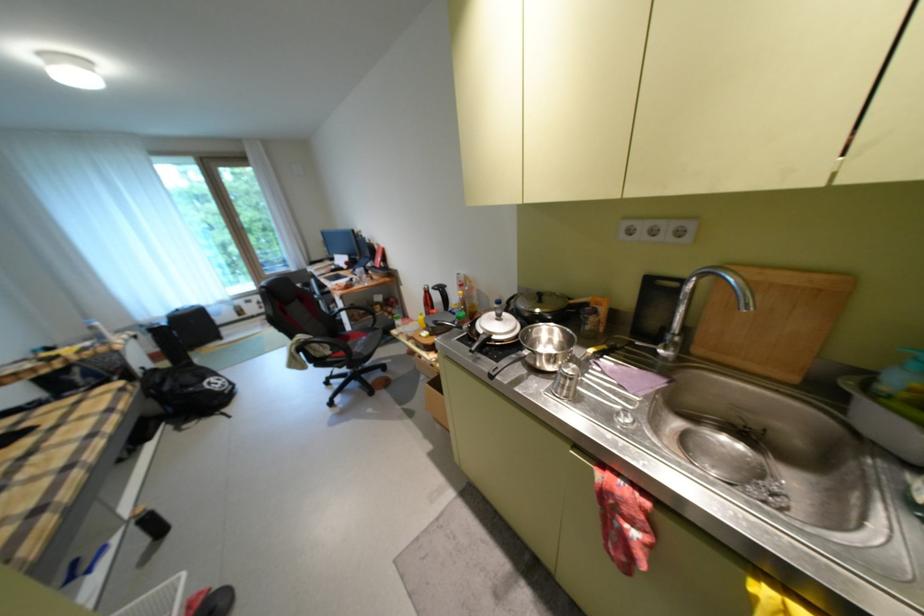
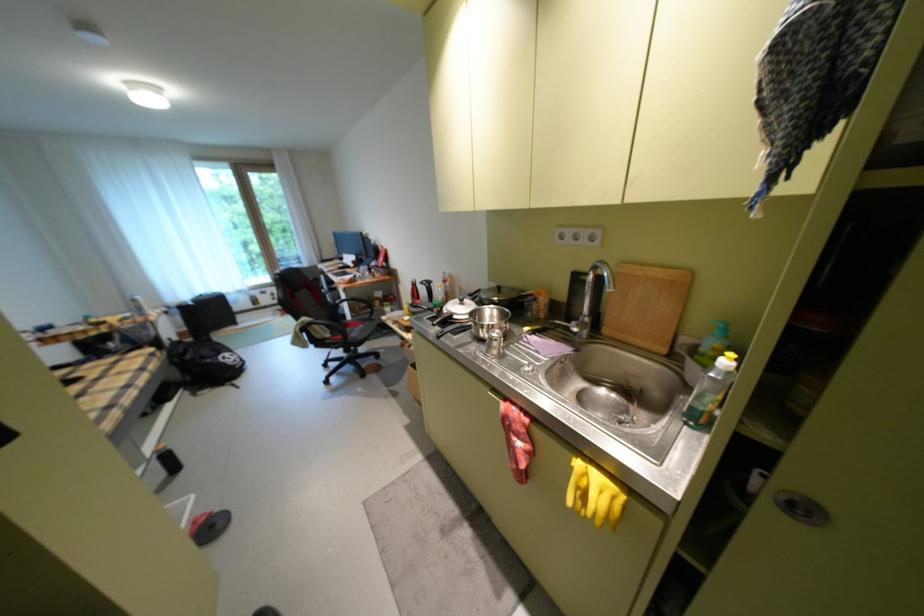
Locate, in the second image, the point that corresponds to pixel 359 329 in the first image.

(359, 318)